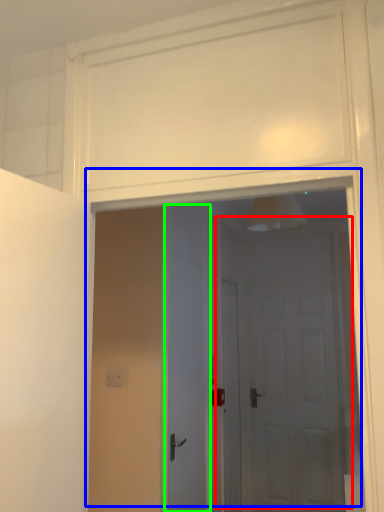
Question: Which object is positioned farthest from door (highlighted by a red box)? Select from door (highlighted by a blue box) and door (highlighted by a green box).

Choices:
 (A) door
 (B) door

Answer: (B)